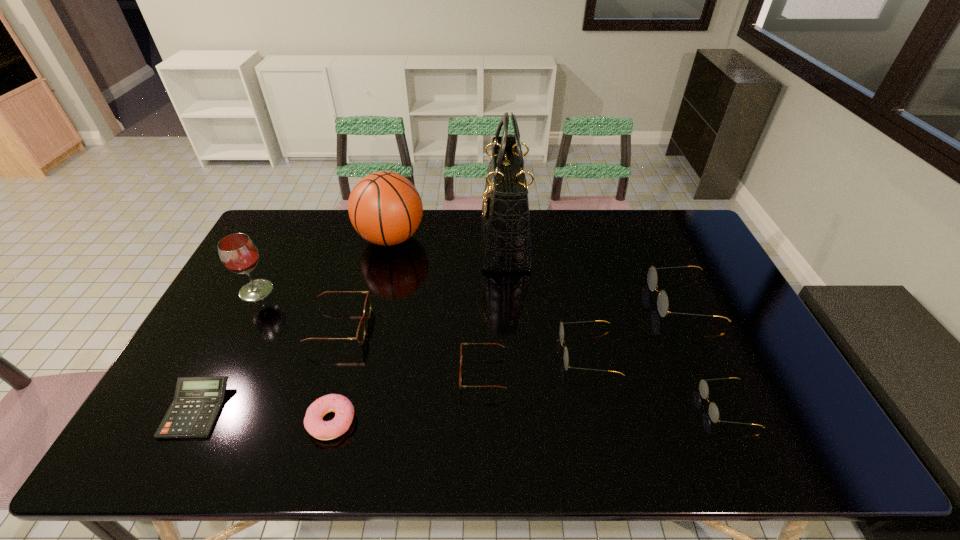
The height and width of the screenshot is (540, 960). I want to click on vacant space that is in between the red wineglass and the doughnut, so click(294, 356).

Locate an element on the screen. This screenshot has height=540, width=960. blank region between the third spectacles from right to left and the tallest spectacles is located at coordinates (635, 326).

You are a GUI agent. You are given a task and a screenshot of the screen. Output one action in this format:
    pyautogui.click(x=<x>, y=<y>)
    Task: Click on the vacant space that is in between the calculator and the pink doughnut
    This screenshot has height=540, width=960.
    Given the screenshot: What is the action you would take?
    pyautogui.click(x=264, y=416)

Locate an element on the screen. empty space between the smallest gold spectacles and the wineglass is located at coordinates (492, 348).

At what (x,y) coordinates should I click in order to perform the action: click on empty space that is in between the biggest gold spectacles and the eighth shortest object. Please return your answer as a coordinate pair (x, y). The width and height of the screenshot is (960, 540). Looking at the image, I should click on [x=469, y=295].

Locate an element on the screen. The image size is (960, 540). blank region between the tallest spectacles and the third spectacles from right to left is located at coordinates (635, 326).

Identify the location of empty location between the pink doughnut and the biggest gold spectacles. click(x=507, y=361).

This screenshot has height=540, width=960. Identify the location of vacant space in between the leftmost gold spectacles and the leftmost spectacles. (464, 340).

Image resolution: width=960 pixels, height=540 pixels. In order to click on vacant point located between the handbag and the basketball in this screenshot , I will do `click(447, 240)`.

Select which object is the seventh closest to the calculator. Please provide its 2D coordinates. Your answer should be formatted as a tuple, i.e. [(x, y)], where the tuple contains the x and y coordinates of a point satisfying the conditions above.

[(561, 331)]